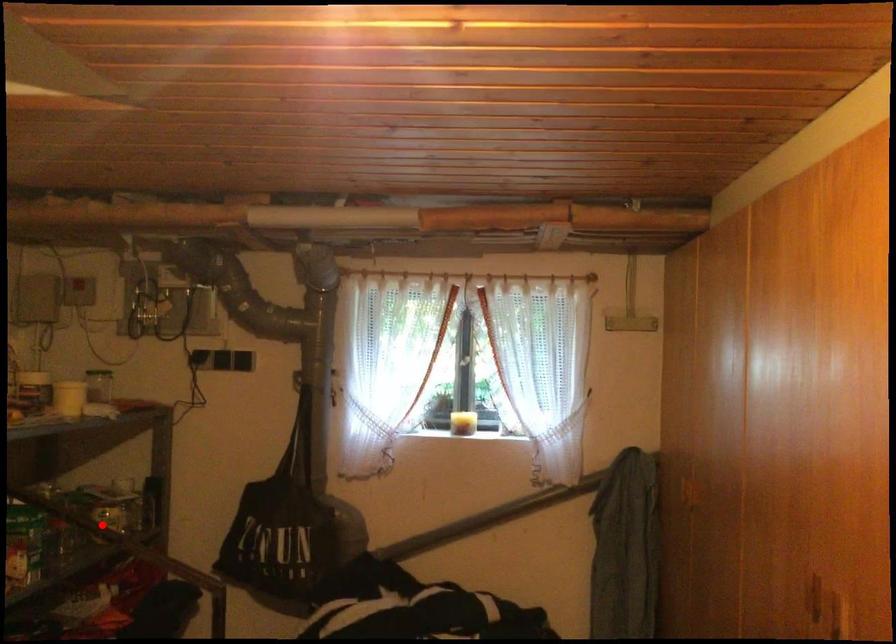
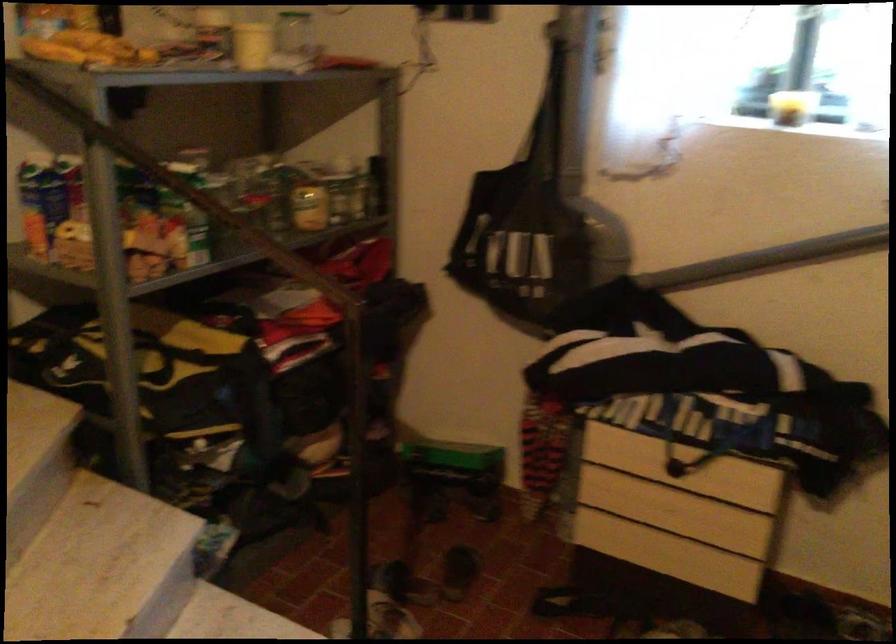
Question: I am providing you with two images of the same scene from different viewpoints. In image1, a red point is highlighted. Considering the same 3D point in image2, which of the following is correct?

Choices:
 (A) It is closer
 (B) It is farther

Answer: (A)